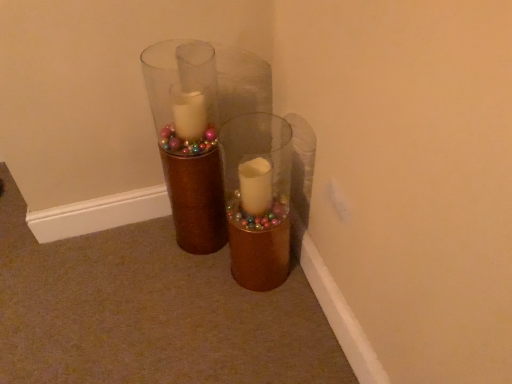
Where is `free location in front of gold glitter vase at center, which is the 2th vase in right-to-left order`? free location in front of gold glitter vase at center, which is the 2th vase in right-to-left order is located at coordinates (196, 278).